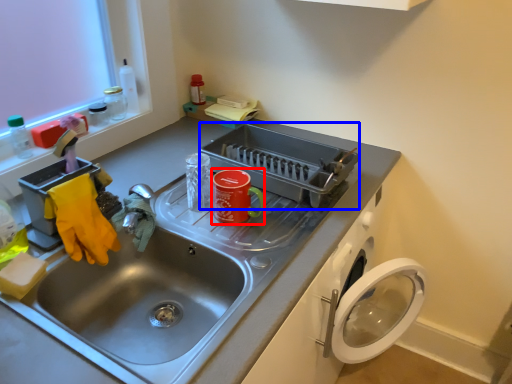
Question: Which point is further to the camera, appliance (highlighted by a red box) or appliance (highlighted by a blue box)?

Choices:
 (A) appliance
 (B) appliance

Answer: (B)